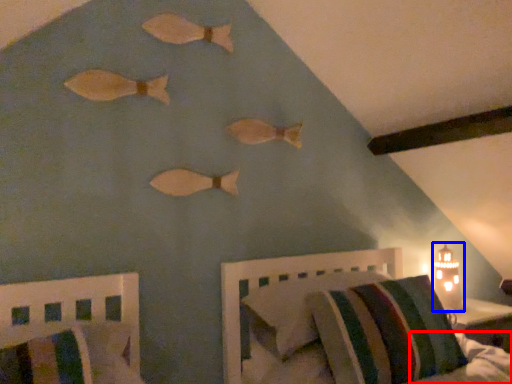
Question: Which of the following is the closest to the observer, mattress (highlighted by a red box) or table lamp (highlighted by a blue box)?

Choices:
 (A) mattress
 (B) table lamp

Answer: (A)